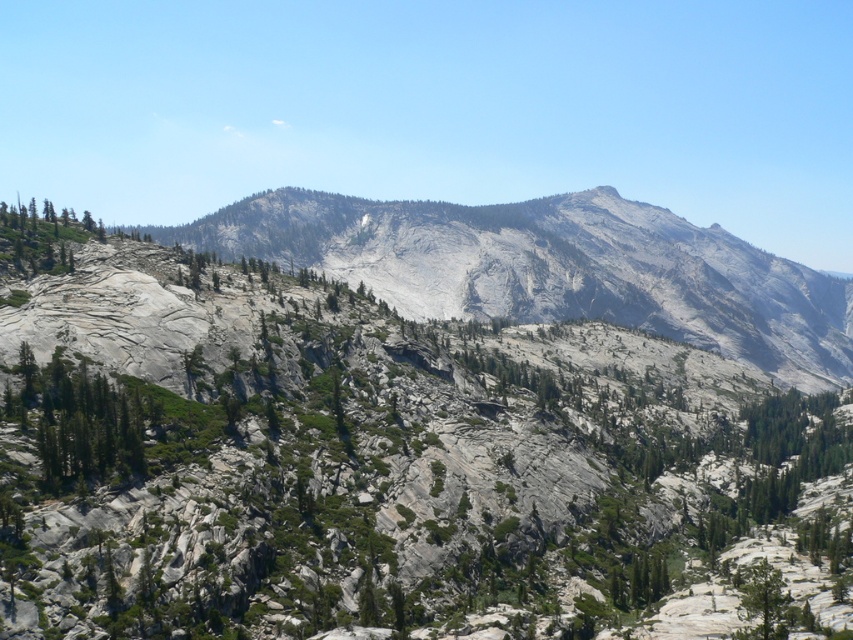
You are a hiker standing at the center of the mountain path between the green leafy tree at lower left and the green leafy tree at lower right. Which tree has a larger canopy width?

The green leafy tree at lower left might be wider than the green leafy tree at lower right, so its canopy could be larger in width.